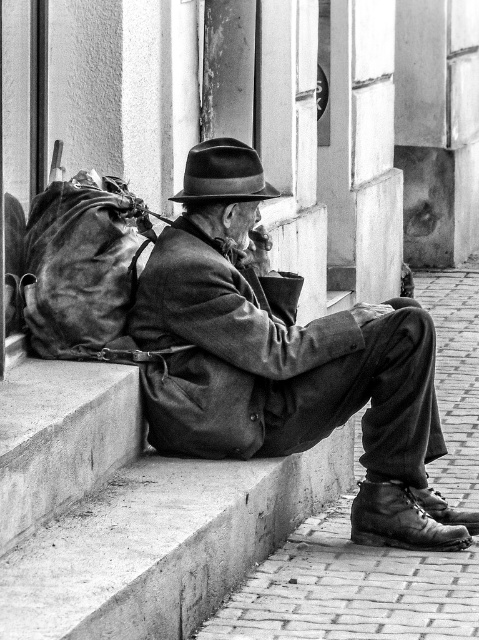
You are a tailor who needs to determine which item requires more fabric to alter between the leather jacket at center and the leather backpack at left. Based on the image, which item would need more fabric?

The leather jacket at center requires more fabric because it has a larger size compared to the leather backpack at left.

You are standing at the point marked as point (288, 316) in the image. The building behind the man has a window that is 2 meters wide. Can you estimate how wide the window appears from your current position?

The distance from the viewer to point (288, 316) is 9.17 meters. The window is 2 meters wide. Using the formula for angular size, the apparent width would be approximately 2 divided by 9.17 multiplied by 57.3 degrees, which calculates to roughly 12 degrees. Therefore, the window appears about 12 degrees wide from your current position.